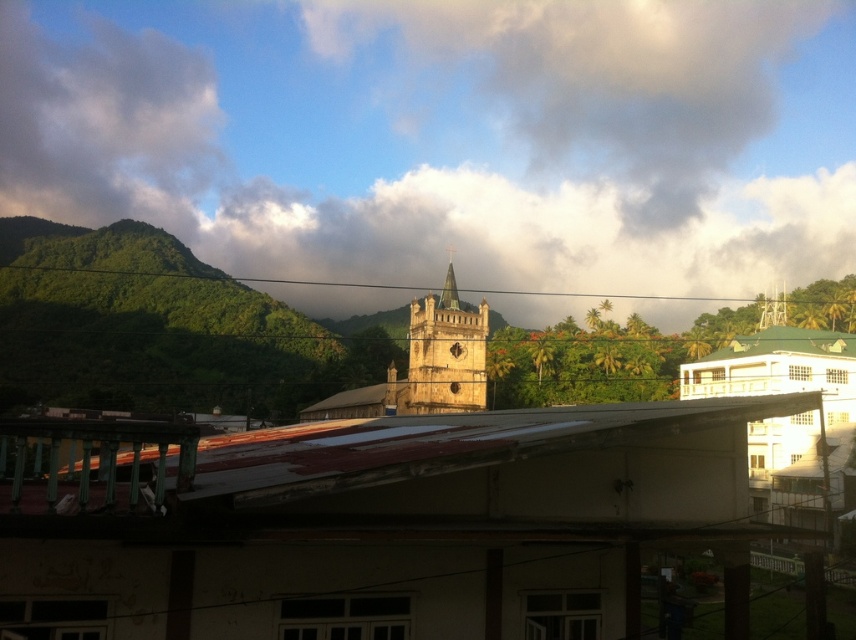
Question: Which point is closer to the camera?

Choices:
 (A) (557, 310)
 (B) (831, 125)

Answer: (A)

Question: Which object is the farthest from the green copper spire at center?

Choices:
 (A) white fluffy cloud at upper center
 (B) golden stone clock tower at center

Answer: (A)

Question: Is golden stone church at center to the left of green copper spire at center from the viewer's perspective?

Choices:
 (A) yes
 (B) no

Answer: (A)

Question: Does cloudy sky at upper center appear on the right side of golden stone clock tower at center?

Choices:
 (A) yes
 (B) no

Answer: (A)

Question: Can you confirm if white fluffy cloud at upper center is positioned above golden stone clock tower at center?

Choices:
 (A) no
 (B) yes

Answer: (B)

Question: Which of the following is the farthest from the observer?

Choices:
 (A) (324, 404)
 (B) (646, 131)
 (C) (325, 244)

Answer: (B)